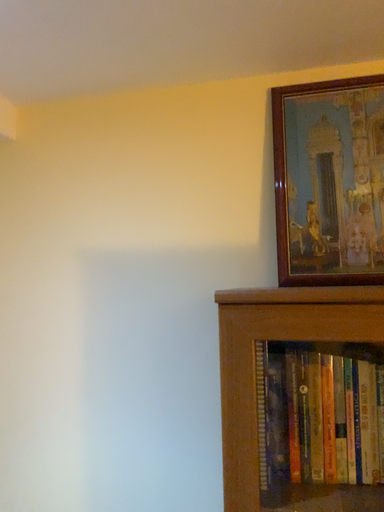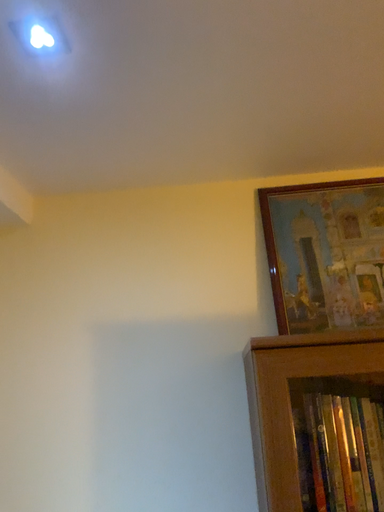
Question: How did the camera likely rotate when shooting the video?

Choices:
 (A) rotated right
 (B) rotated left

Answer: (A)